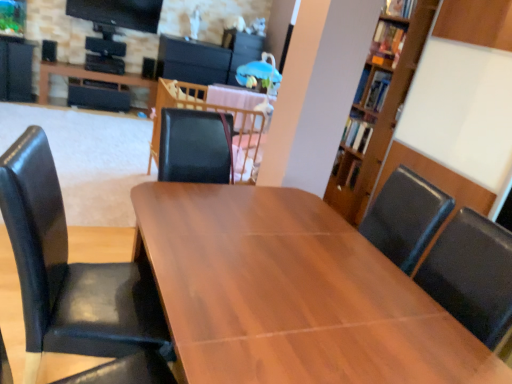
Question: Does wooden table at center, acting as the 1th table starting from the bottom, have a greater width compared to matte black table at upper left, marked as the 1th table in a left-to-right arrangement?

Choices:
 (A) yes
 (B) no

Answer: (A)

Question: Does wooden table at center, the third table viewed from the left, have a larger size compared to matte black table at upper left, acting as the 3th table starting from the bottom?

Choices:
 (A) no
 (B) yes

Answer: (B)

Question: From the image's perspective, is wooden table at center, the third table viewed from the left, over matte black table at upper left, acting as the 3th table starting from the bottom?

Choices:
 (A) yes
 (B) no

Answer: (B)

Question: Does wooden table at center, the third table viewed from the left, appear on the left side of matte black table at upper left, positioned as the 3th table in front-to-back order?

Choices:
 (A) no
 (B) yes

Answer: (A)

Question: Considering the relative sizes of wooden table at center, the third table viewed from the left, and matte black table at upper left, positioned as the 3th table in front-to-back order, in the image provided, is wooden table at center, the third table viewed from the left, taller than matte black table at upper left, positioned as the 3th table in front-to-back order,?

Choices:
 (A) no
 (B) yes

Answer: (B)

Question: Is wooden table at center, the third table viewed from the left, smaller than matte black table at upper left, positioned as the first table in top-to-bottom order?

Choices:
 (A) no
 (B) yes

Answer: (A)

Question: Is black leather chair at left at the left side of wooden table at center, marked as the second table in a front-to-back arrangement?

Choices:
 (A) no
 (B) yes

Answer: (B)

Question: Is black leather chair at left not close to wooden table at center, the second table positioned from the back?

Choices:
 (A) no
 (B) yes

Answer: (B)

Question: From a real-world perspective, is black leather chair at left positioned over wooden table at center, the second table in the bottom-to-top sequence, based on gravity?

Choices:
 (A) no
 (B) yes

Answer: (A)

Question: Is wooden table at center, the second table positioned from the back, located within black leather chair at left?

Choices:
 (A) yes
 (B) no

Answer: (B)

Question: Is the surface of black leather chair at left in direct contact with wooden table at center, the 2th table in the top-to-bottom sequence?

Choices:
 (A) no
 (B) yes

Answer: (A)

Question: Is wooden table at center, marked as the second table in a front-to-back arrangement, at the back of black leather chair at left?

Choices:
 (A) no
 (B) yes

Answer: (A)

Question: Can you confirm if wooden table at center, the 2th table in the top-to-bottom sequence, is taller than black leather chair at left?

Choices:
 (A) yes
 (B) no

Answer: (B)